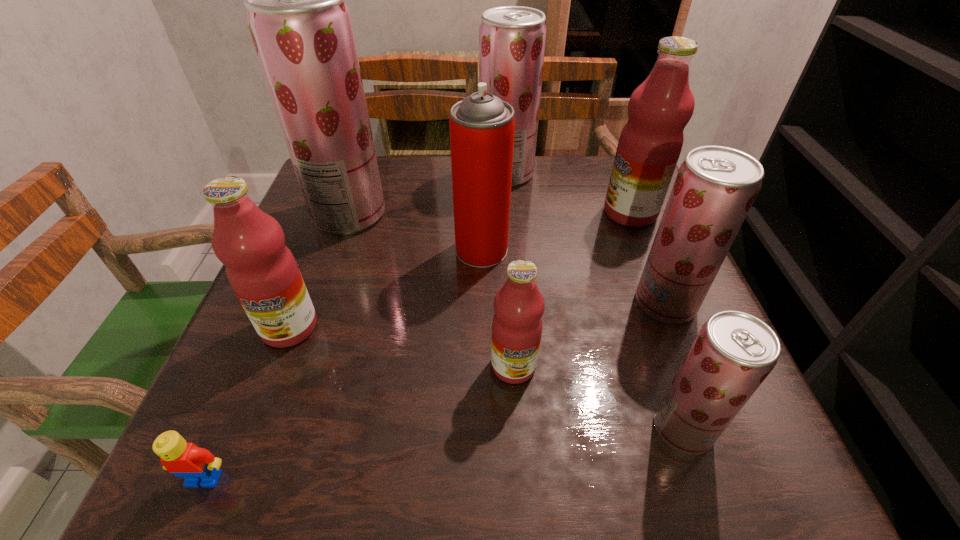
Find the location of a particular element. This screenshot has width=960, height=540. unoccupied area between the nearest strawberry fruit juice and the leftmost pink fruit juice is located at coordinates (486, 378).

This screenshot has width=960, height=540. Identify the location of vacant region between the smallest pink fruit juice and the leftmost pink fruit juice. [401, 347].

The image size is (960, 540). In order to click on vacant space in between the third farthest strawberry fruit juice and the shortest object in this screenshot , I will do `click(435, 390)`.

Find the location of a particular element. The image size is (960, 540). vacant space in between the smallest strawberry fruit juice and the second biggest pink fruit juice is located at coordinates (486, 378).

Locate an element on the screen. This screenshot has height=540, width=960. vacant area that lies between the aerosol can and the tallest object is located at coordinates (416, 232).

Identify the location of vacant space that is in between the third biggest strawberry fruit juice and the smallest pink fruit juice. This screenshot has width=960, height=540. (589, 334).

Select which object is the closest to the nearest strawberry fruit juice. Please provide its 2D coordinates. Your answer should be formatted as a tuple, i.e. [(x, y)], where the tuple contains the x and y coordinates of a point satisfying the conditions above.

[(715, 187)]

Select which object appears as the closest to the red aerosol can. Please provide its 2D coordinates. Your answer should be formatted as a tuple, i.e. [(x, y)], where the tuple contains the x and y coordinates of a point satisfying the conditions above.

[(301, 28)]

You are a GUI agent. You are given a task and a screenshot of the screen. Output one action in this format:
    pyautogui.click(x=<x>, y=<y>)
    Task: Click on the second closest fruit juice to the leftmost strawberry fruit juice
    
    Given the screenshot: What is the action you would take?
    pyautogui.click(x=512, y=39)

Point out which fruit juice is positioned as the sixth nearest to the rightmost pink fruit juice. Please provide its 2D coordinates. Your answer should be formatted as a tuple, i.e. [(x, y)], where the tuple contains the x and y coordinates of a point satisfying the conditions above.

[(262, 271)]